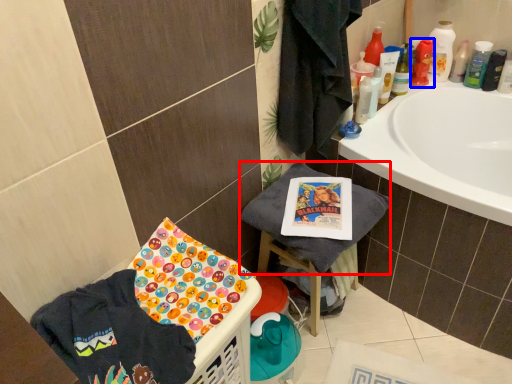
Question: Which point is further to the camera, beach towel (highlighted by a red box) or mouthwash (highlighted by a blue box)?

Choices:
 (A) beach towel
 (B) mouthwash

Answer: (B)